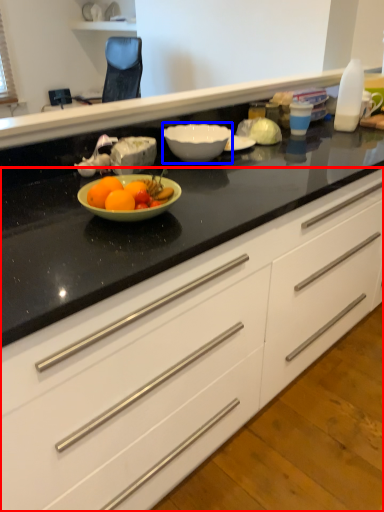
Question: Which point is further to the camera, cabinetry (highlighted by a red box) or bowl (highlighted by a blue box)?

Choices:
 (A) cabinetry
 (B) bowl

Answer: (B)